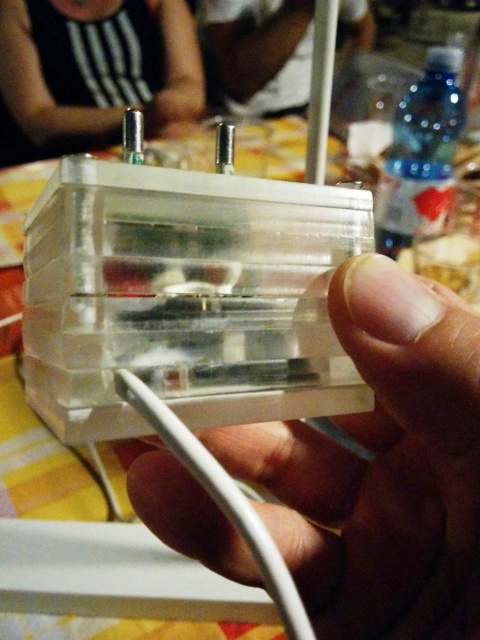
Question: Does transparent plastic hand at center appear on the right side of black striped tank top at upper left?

Choices:
 (A) yes
 (B) no

Answer: (A)

Question: Which is nearer to the black striped tank top at upper left?

Choices:
 (A) white shirt at upper center
 (B) transparent plastic hand at center

Answer: (A)

Question: Is transparent plastic hand at center to the right of white shirt at upper center from the viewer's perspective?

Choices:
 (A) yes
 (B) no

Answer: (B)

Question: Which is farther from the black striped tank top at upper left?

Choices:
 (A) white shirt at upper center
 (B) transparent plastic hand at center

Answer: (B)

Question: Estimate the real-world distances between objects in this image. Which object is farther from the transparent plastic hand at center?

Choices:
 (A) black striped tank top at upper left
 (B) white shirt at upper center

Answer: (B)

Question: Does transparent plastic hand at center appear on the left side of black striped tank top at upper left?

Choices:
 (A) no
 (B) yes

Answer: (A)